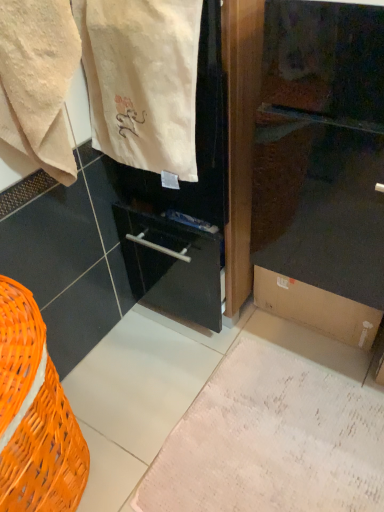
Question: Is white textured rug at lower center bigger than beige cotton towel at upper left?

Choices:
 (A) yes
 (B) no

Answer: (B)

Question: Is white textured rug at lower center outside beige cotton towel at upper left?

Choices:
 (A) no
 (B) yes

Answer: (B)

Question: From the image's perspective, is white textured rug at lower center over beige cotton towel at upper left?

Choices:
 (A) no
 (B) yes

Answer: (A)

Question: Considering the relative positions of white textured rug at lower center and beige cotton towel at upper left in the image provided, is white textured rug at lower center behind beige cotton towel at upper left?

Choices:
 (A) yes
 (B) no

Answer: (A)

Question: Does white textured rug at lower center have a lesser width compared to beige cotton towel at upper left?

Choices:
 (A) yes
 (B) no

Answer: (B)

Question: Does white textured rug at lower center come in front of beige cotton towel at upper left?

Choices:
 (A) yes
 (B) no

Answer: (B)

Question: Does orange wicker basket at lower left have a greater height compared to white textured rug at lower center?

Choices:
 (A) yes
 (B) no

Answer: (A)

Question: From a real-world perspective, is orange wicker basket at lower left under white textured rug at lower center?

Choices:
 (A) yes
 (B) no

Answer: (B)

Question: From a real-world perspective, is orange wicker basket at lower left on white textured rug at lower center?

Choices:
 (A) no
 (B) yes

Answer: (B)

Question: Can you confirm if orange wicker basket at lower left is bigger than white textured rug at lower center?

Choices:
 (A) yes
 (B) no

Answer: (A)

Question: Considering the relative positions of orange wicker basket at lower left and white textured rug at lower center in the image provided, is orange wicker basket at lower left to the right of white textured rug at lower center from the viewer's perspective?

Choices:
 (A) no
 (B) yes

Answer: (A)

Question: Is orange wicker basket at lower left smaller than white textured rug at lower center?

Choices:
 (A) yes
 (B) no

Answer: (B)

Question: From a real-world perspective, is brown cardboard box at lower right over white textured rug at lower center?

Choices:
 (A) no
 (B) yes

Answer: (B)